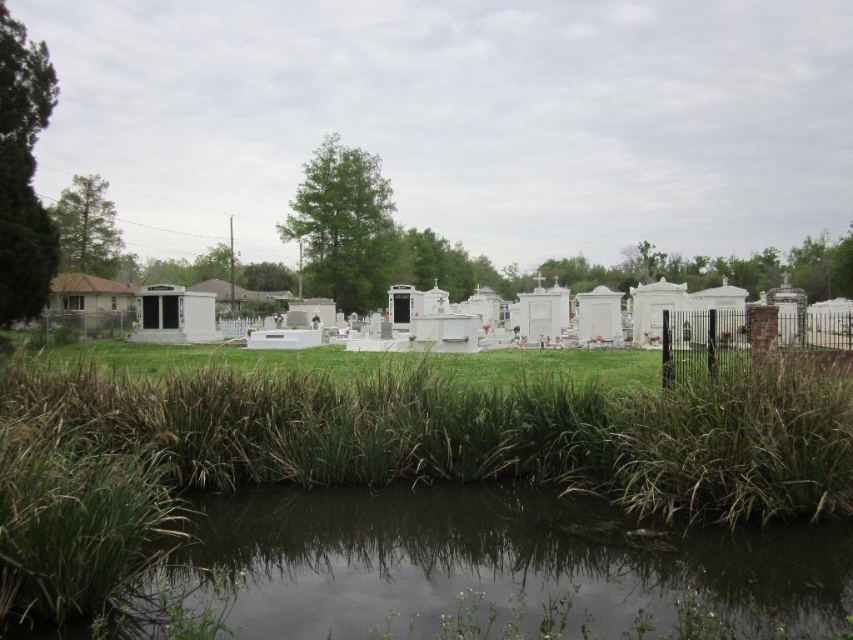
Question: Among these points, which one is nearest to the camera?

Choices:
 (A) (195, 388)
 (B) (747, 356)
 (C) (764, 608)

Answer: (C)

Question: Does green grass at lower center have a larger size compared to green grassy water at lower center?

Choices:
 (A) no
 (B) yes

Answer: (B)

Question: Can you confirm if green grass at lower center is positioned below green grassy water at lower center?

Choices:
 (A) no
 (B) yes

Answer: (A)

Question: Does green grass at lower center appear over green grassy water at lower center?

Choices:
 (A) yes
 (B) no

Answer: (A)

Question: Which object is closer to the camera taking this photo?

Choices:
 (A) green grass at lower center
 (B) black wrought iron fence at right
 (C) green grassy water at lower center

Answer: (A)

Question: Which point is closer to the camera?

Choices:
 (A) (297, 564)
 (B) (518, 438)
 (C) (706, 348)

Answer: (A)